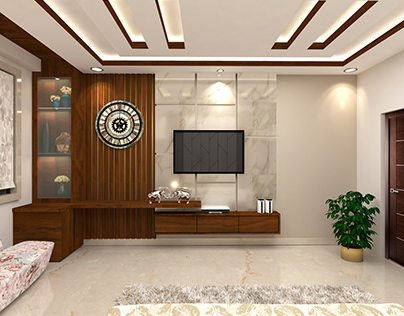
Find the location of a particular element. door handle is located at coordinates (392, 190).